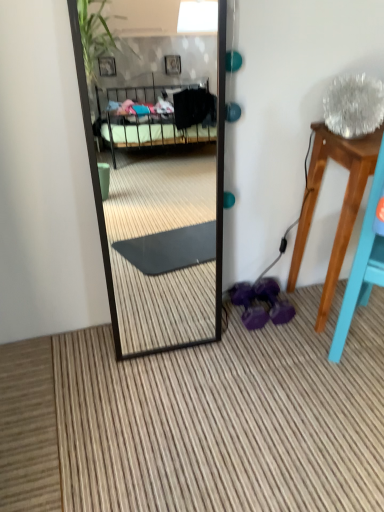
Question: Is point (349, 139) positioned closer to the camera than point (236, 291)?

Choices:
 (A) closer
 (B) farther

Answer: (A)

Question: Considering the positions of wooden stool at right and purple rubber dumbbells at lower center in the image, is wooden stool at right bigger or smaller than purple rubber dumbbells at lower center?

Choices:
 (A) big
 (B) small

Answer: (A)

Question: Considering the positions of wooden stool at right and purple rubber dumbbells at lower center in the image, is wooden stool at right taller or shorter than purple rubber dumbbells at lower center?

Choices:
 (A) tall
 (B) short

Answer: (A)

Question: From their relative heights in the image, would you say purple rubber dumbbells at lower center is taller or shorter than wooden stool at right?

Choices:
 (A) tall
 (B) short

Answer: (B)

Question: Is purple rubber dumbbells at lower center wider or thinner than wooden stool at right?

Choices:
 (A) thin
 (B) wide

Answer: (A)

Question: From a real-world perspective, relative to wooden stool at right, is purple rubber dumbbells at lower center vertically above or below?

Choices:
 (A) above
 (B) below

Answer: (B)

Question: Is point (253, 311) closer or farther from the camera than point (331, 275)?

Choices:
 (A) farther
 (B) closer

Answer: (A)